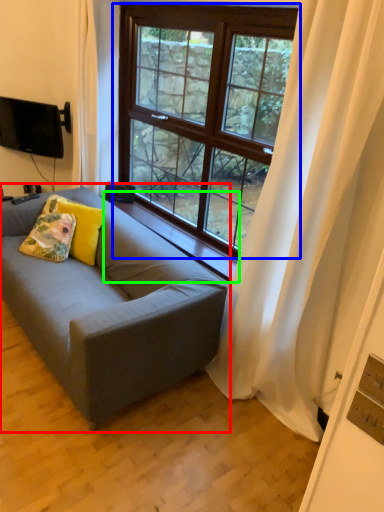
Question: Considering the real-world distances, which object is closest to studio couch (highlighted by a red box)? window (highlighted by a blue box) or window sill (highlighted by a green box).

Choices:
 (A) window
 (B) window sill

Answer: (B)